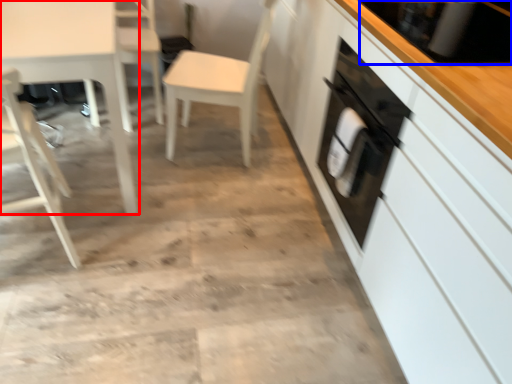
Question: Which point is closer to the camera, table (highlighted by a red box) or appliance (highlighted by a blue box)?

Choices:
 (A) table
 (B) appliance

Answer: (B)